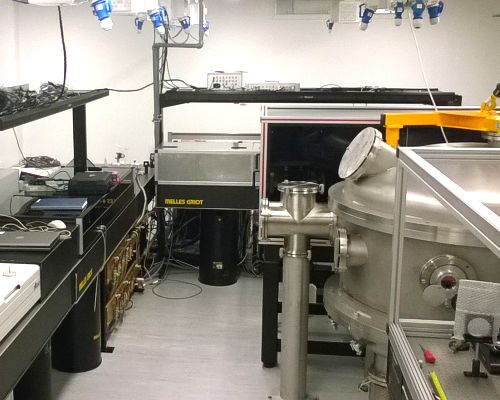
Locate an element on the screen. printer equipment is located at coordinates (37, 299).